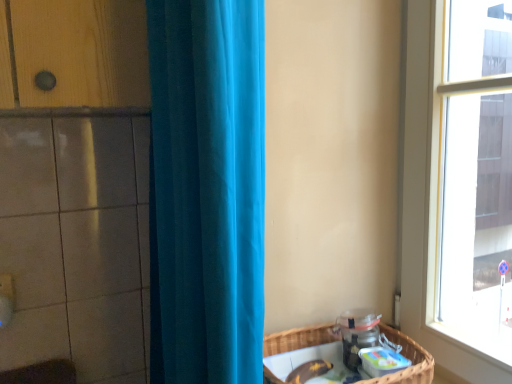
Question: In the image, is teal fabric curtain at center positioned in front of or behind woven brown basket at lower right?

Choices:
 (A) behind
 (B) front

Answer: (B)

Question: Considering the positions of teal fabric curtain at center and woven brown basket at lower right in the image, is teal fabric curtain at center bigger or smaller than woven brown basket at lower right?

Choices:
 (A) big
 (B) small

Answer: (A)

Question: Is teal fabric curtain at center situated inside woven brown basket at lower right or outside?

Choices:
 (A) outside
 (B) inside

Answer: (A)

Question: From a real-world perspective, is woven brown basket at lower right physically located above or below teal fabric curtain at center?

Choices:
 (A) above
 (B) below

Answer: (B)

Question: Considering the relative positions of woven brown basket at lower right and teal fabric curtain at center in the image provided, is woven brown basket at lower right to the left or to the right of teal fabric curtain at center?

Choices:
 (A) left
 (B) right

Answer: (B)

Question: Considering the positions of woven brown basket at lower right and teal fabric curtain at center in the image, is woven brown basket at lower right bigger or smaller than teal fabric curtain at center?

Choices:
 (A) small
 (B) big

Answer: (A)

Question: Relative to teal fabric curtain at center, is woven brown basket at lower right in front or behind?

Choices:
 (A) behind
 (B) front

Answer: (A)